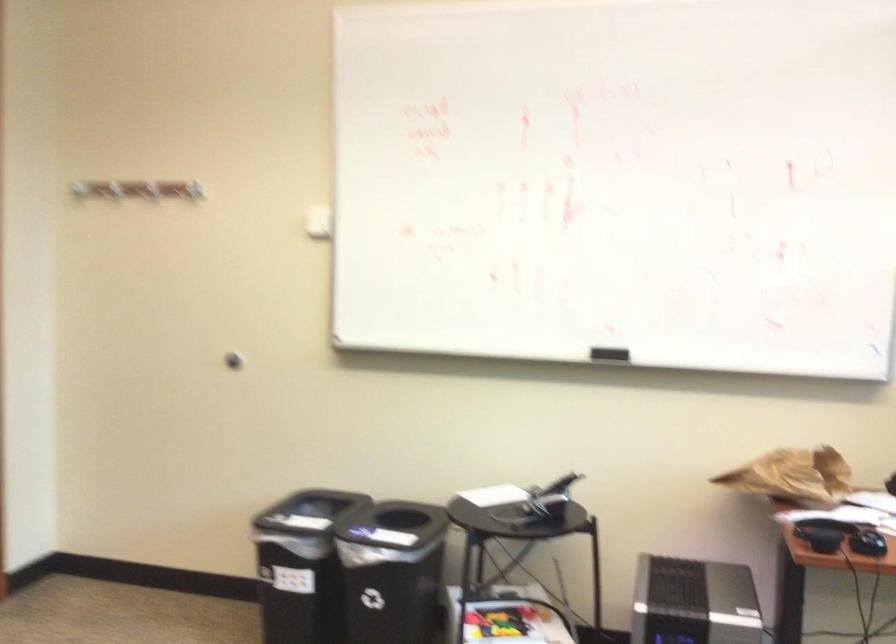
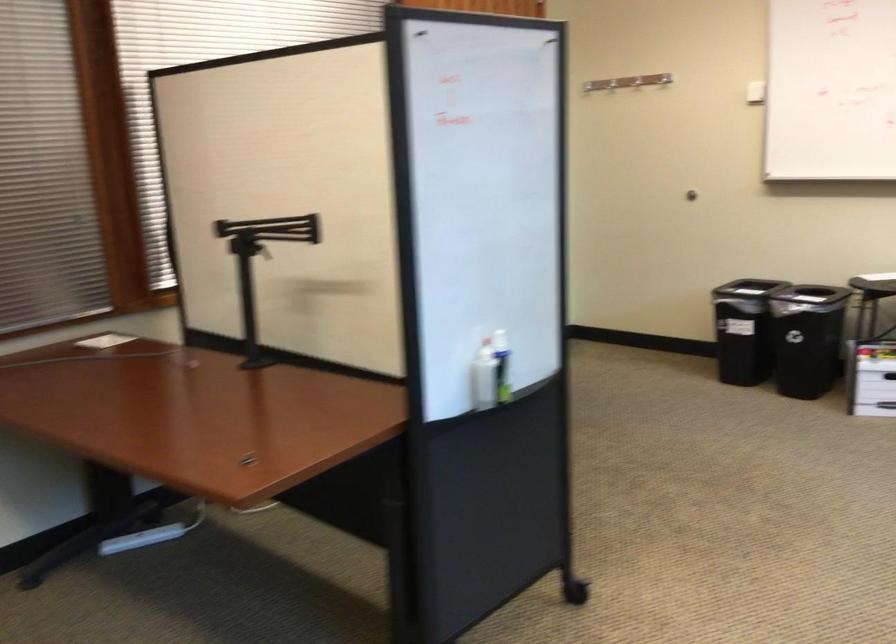
Where in the second image is the point corresponding to point 227,200 from the first image?

(610, 84)